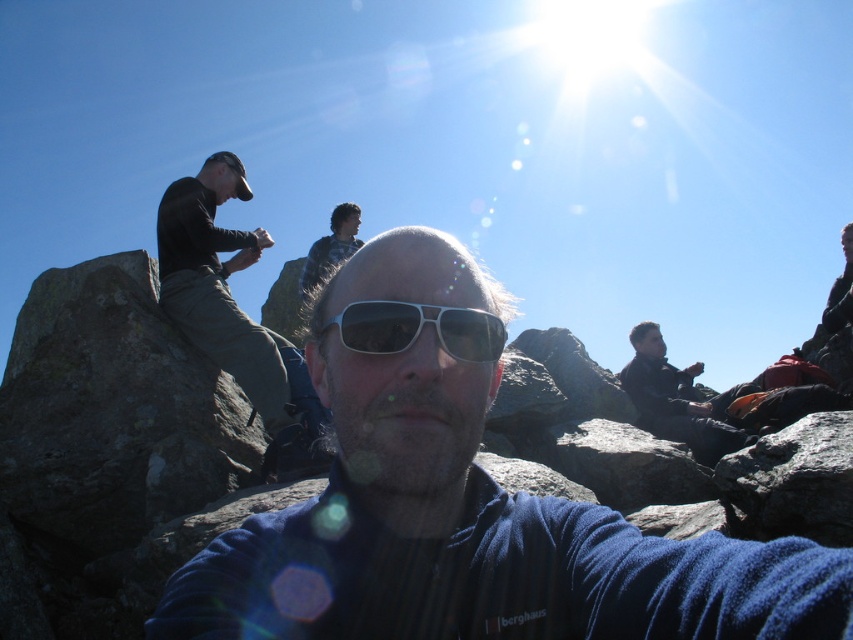
You are a photographer standing at the edge of the rocky outcrop. You want to capture a closeup shot of the blue fabric shirt at center without moving the subject. Given that your camera can focus clearly up to 20 inches, will you be able to get a clear closeup?

The blue fabric shirt at center is 20.17 inches away from the camera, which is slightly beyond the camera focus range of 20 inches. Therefore, the closeup may not be clear.

You are a photographer trying to capture the person taking a selfie. Where should you position yourself to ensure the sunglasses are in the frame? The scene includes a rocky outcrop with people scattered around. The sunglasses are located at point (419, 328). Please mention the exact coordinates of the sunglasses in your answer.

The sunglasses are located at point (419, 328). To capture the person taking a selfie with the sunglasses in the frame, position yourself at a central viewpoint that includes the center area where the sunglasses are placed.

You are a photographer analyzing the composition of this image. The sunglasses at center are positioned at coordinates. What are their exact coordinates?

The sunglasses at center are located at the coordinates (419,328).